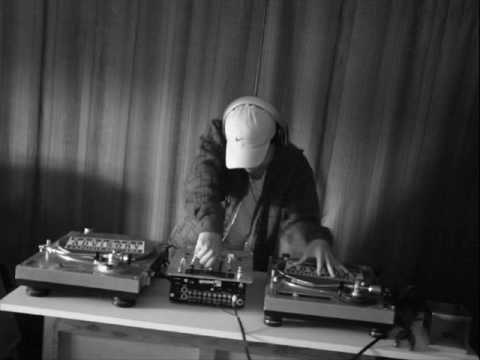
Locate an element on the screen. The image size is (480, 360). gray curtain is located at coordinates (140, 72).